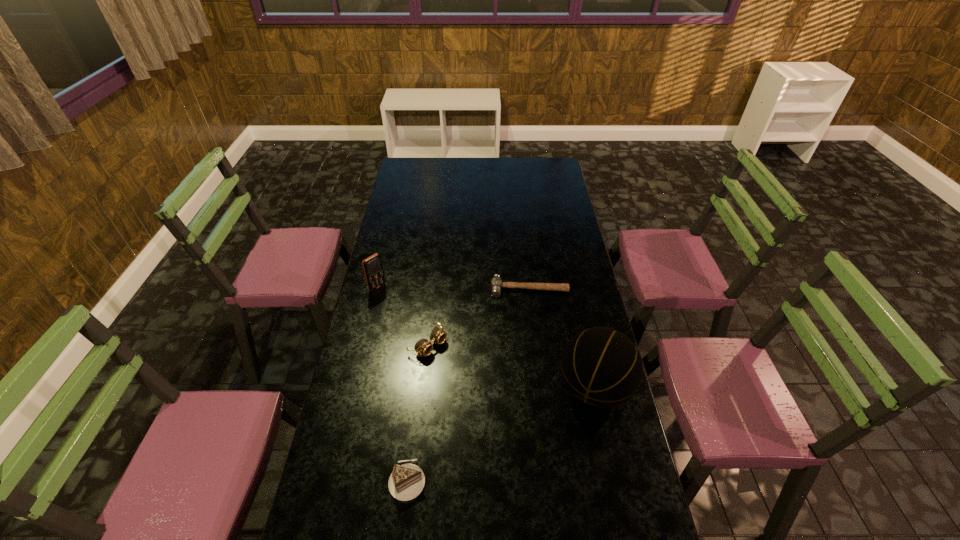
Identify the location of free space located through the lenses of the goggles. (511, 406).

Image resolution: width=960 pixels, height=540 pixels. Identify the location of free space located 0.120m on the screen of the leftmost object. (400, 307).

Identify the location of vacant space located on the screen of the leftmost object. The image size is (960, 540). (402, 308).

You are a GUI agent. You are given a task and a screenshot of the screen. Output one action in this format:
    pyautogui.click(x=<x>, y=<y>)
    Task: Click on the free location located on the screen of the leftmost object
    The image size is (960, 540).
    Given the screenshot: What is the action you would take?
    pyautogui.click(x=397, y=305)

Find the location of `vacant space located on the striking face of the shortest object`. vacant space located on the striking face of the shortest object is located at coordinates 528,307.

You are a GUI agent. You are given a task and a screenshot of the screen. Output one action in this format:
    pyautogui.click(x=<x>, y=<y>)
    Task: Click on the vacant space located on the striking face of the shortest object
    Image resolution: width=960 pixels, height=540 pixels.
    Given the screenshot: What is the action you would take?
    pyautogui.click(x=528, y=315)

Where is `free space located on the striking face of the shortest object`? Image resolution: width=960 pixels, height=540 pixels. free space located on the striking face of the shortest object is located at coordinates (528, 309).

You are a GUI agent. You are given a task and a screenshot of the screen. Output one action in this format:
    pyautogui.click(x=<x>, y=<y>)
    Task: Click on the object that is at the near edge
    This screenshot has width=960, height=540.
    Given the screenshot: What is the action you would take?
    pyautogui.click(x=406, y=482)

Where is `object present at the left edge`? The height and width of the screenshot is (540, 960). object present at the left edge is located at coordinates 373,269.

Find the location of a particular element. basketball that is at the right edge is located at coordinates (601, 367).